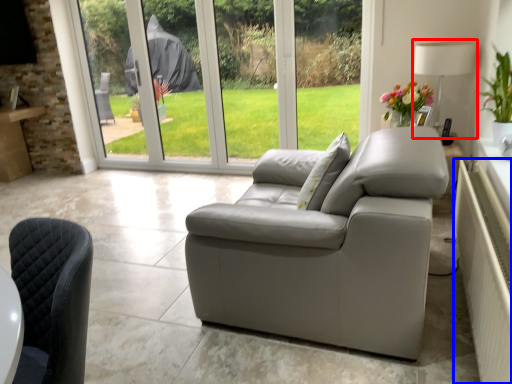
Question: Which point is closer to the camera, lamp (highlighted by a red box) or radiator (highlighted by a blue box)?

Choices:
 (A) lamp
 (B) radiator

Answer: (B)